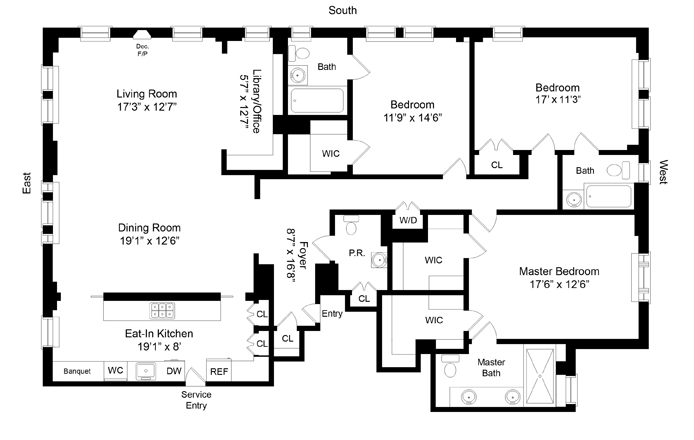
Locate an element on the screen. master bedroom is located at coordinates pyautogui.click(x=539, y=263).